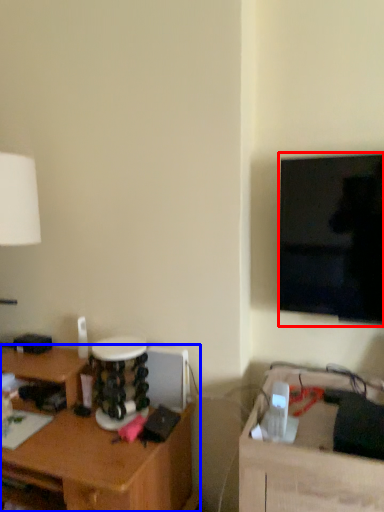
Question: Among these objects, which one is nearest to the camera, television (highlighted by a red box) or desk (highlighted by a blue box)?

Choices:
 (A) television
 (B) desk

Answer: (B)